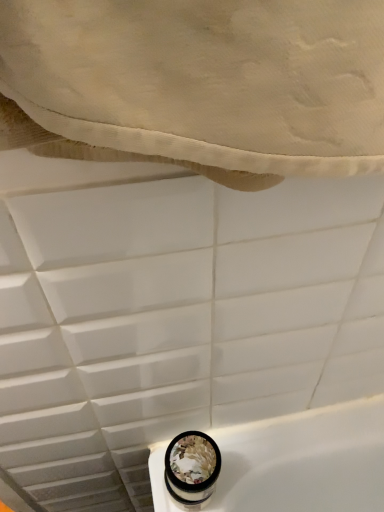
The height and width of the screenshot is (512, 384). What do you see at coordinates (192, 469) in the screenshot?
I see `translucent floral-patterned jar at bottom right` at bounding box center [192, 469].

Locate an element on the screen. This screenshot has width=384, height=512. translucent floral-patterned jar at bottom right is located at coordinates (192, 469).

In order to face translucent floral-patterned jar at bottom right, should I rotate leftwards or rightwards?

To align with it, rotate right about 0.248°.

Locate an element on the screen. This screenshot has height=512, width=384. translucent floral-patterned jar at bottom right is located at coordinates (192, 469).